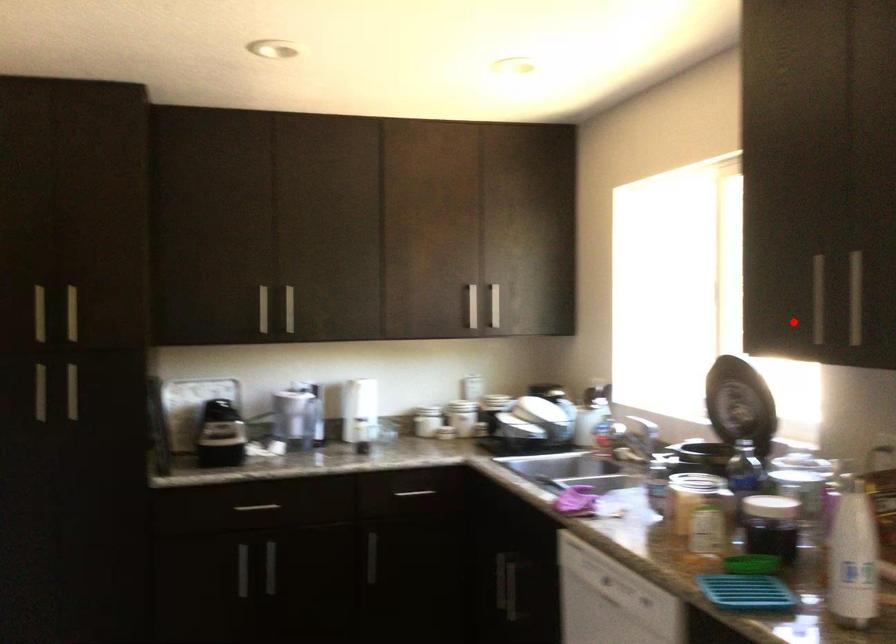
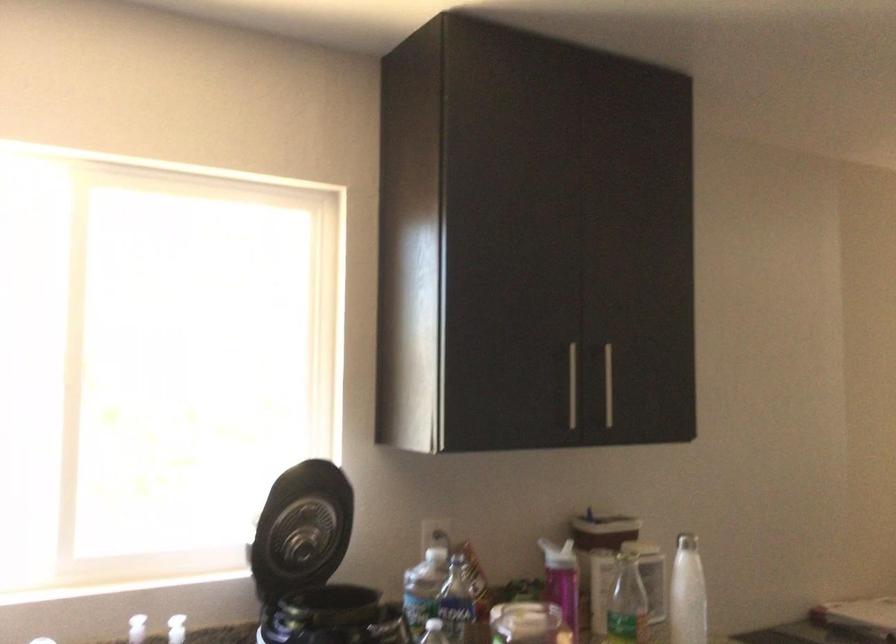
Locate, in the second image, the point that corresponds to the highlighted location in the first image.

(572, 386)